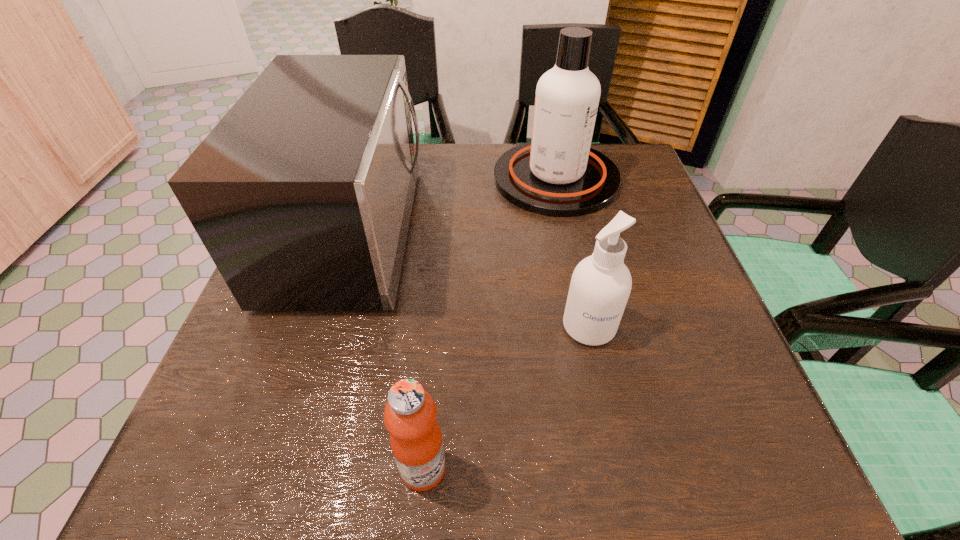
The height and width of the screenshot is (540, 960). Find the location of `vacant space situated on the front label of the second shortest object`. vacant space situated on the front label of the second shortest object is located at coordinates (620, 470).

Identify the location of vacant region located on the front label of the nearest object. (683, 468).

The image size is (960, 540). I want to click on cleansing agent located at the far edge, so click(x=557, y=174).

The height and width of the screenshot is (540, 960). What are the coordinates of `microwave oven located at the far edge` in the screenshot? It's located at (302, 194).

The height and width of the screenshot is (540, 960). What are the coordinates of `object present at the near edge` in the screenshot? It's located at (410, 414).

Locate an element on the screen. The image size is (960, 540). object that is at the left edge is located at coordinates (302, 194).

The width and height of the screenshot is (960, 540). I want to click on object positioned at the right edge, so click(557, 174).

You are a GUI agent. You are given a task and a screenshot of the screen. Output one action in this format:
    pyautogui.click(x=<x>, y=<y>)
    Task: Click on the object situated at the far left corner
    Image resolution: width=960 pixels, height=540 pixels.
    Given the screenshot: What is the action you would take?
    pyautogui.click(x=302, y=194)

This screenshot has width=960, height=540. I want to click on object that is at the far right corner, so click(557, 174).

Locate an element on the screen. The width and height of the screenshot is (960, 540). free space at the near edge of the desktop is located at coordinates [558, 495].